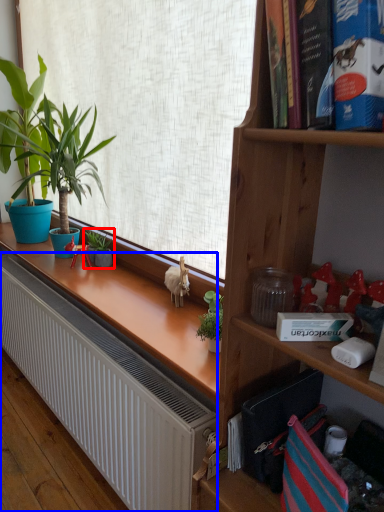
Question: Among these objects, which one is farthest to the camera, houseplant (highlighted by a red box) or radiator (highlighted by a blue box)?

Choices:
 (A) houseplant
 (B) radiator

Answer: (A)